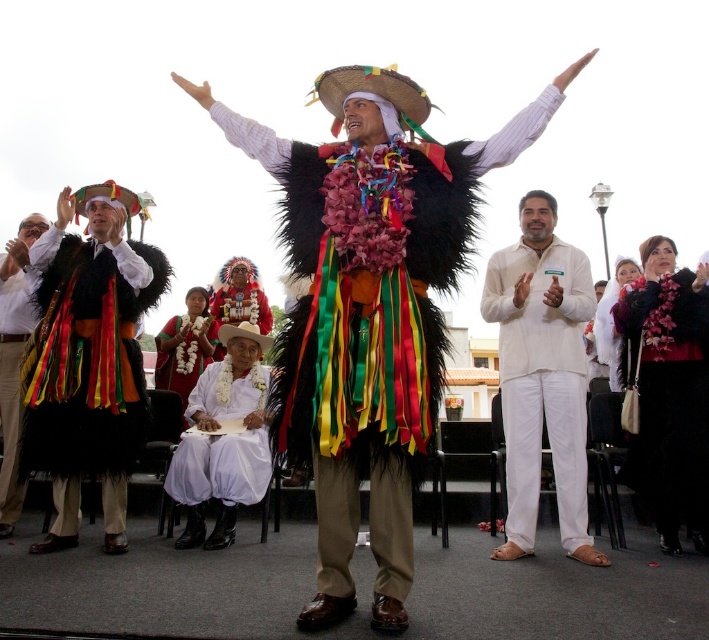
Question: Among these points, which one is farthest from the camera?

Choices:
 (A) [x=178, y=336]
 (B) [x=691, y=436]

Answer: (A)

Question: Which object is farther from the camera taking this photo?

Choices:
 (A) matte black feathered vest at left
 (B) feathered costume at center
 (C) black feathered vest at left
 (D) velvet black dress at center

Answer: (A)

Question: Does velvet black dress at center appear on the right side of matte black feathered vest at left?

Choices:
 (A) yes
 (B) no

Answer: (A)

Question: Can you confirm if white cotton pants at center is positioned below matte black feathered vest at left?

Choices:
 (A) no
 (B) yes

Answer: (B)

Question: Among these points, which one is farthest from the camera?

Choices:
 (A) (423, 284)
 (B) (179, 368)

Answer: (B)

Question: Does white cotton pants at center appear on the left side of white fabric at center?

Choices:
 (A) no
 (B) yes

Answer: (A)